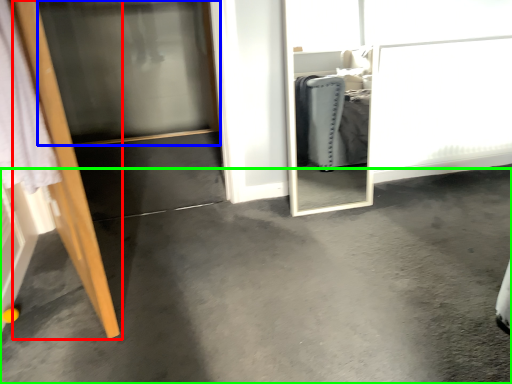
Question: Which object is the farthest from door (highlighted by a red box)? Choose among these: screen door (highlighted by a blue box) or concrete (highlighted by a green box).

Choices:
 (A) screen door
 (B) concrete

Answer: (A)